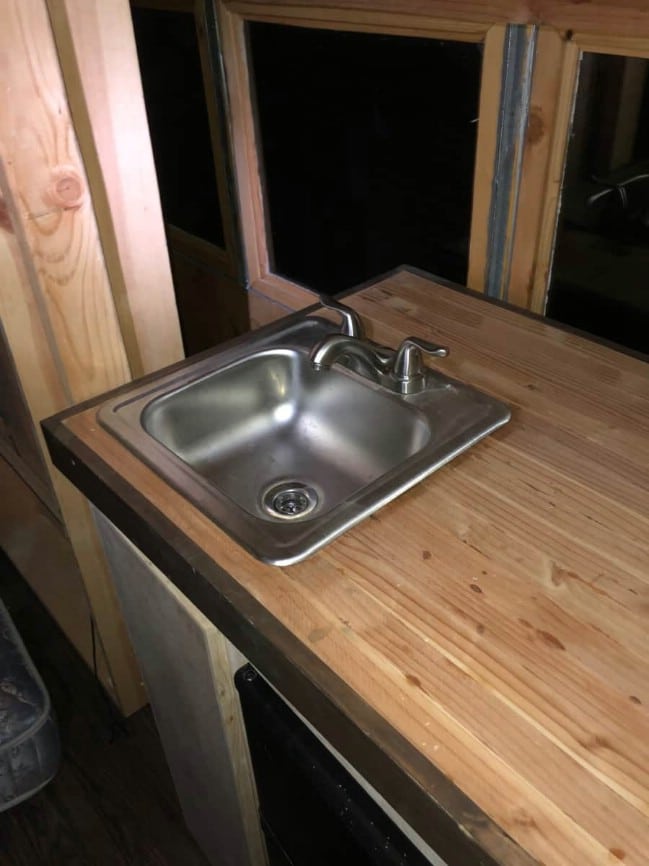
Image resolution: width=649 pixels, height=866 pixels. Find the location of `small sink`. small sink is located at coordinates (310, 435).